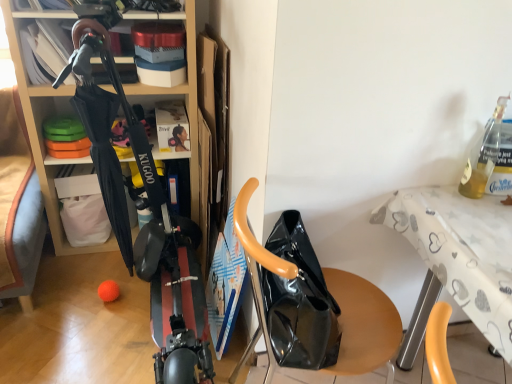
Question: Is glossy black bag at center next to black glossy scooter at center?

Choices:
 (A) yes
 (B) no

Answer: (B)

Question: Could you tell me if glossy black bag at center is facing black glossy scooter at center?

Choices:
 (A) yes
 (B) no

Answer: (B)

Question: From a real-world perspective, is glossy black bag at center below black glossy scooter at center?

Choices:
 (A) yes
 (B) no

Answer: (A)

Question: From the image's perspective, does glossy black bag at center appear higher than black glossy scooter at center?

Choices:
 (A) yes
 (B) no

Answer: (B)

Question: Does glossy black bag at center have a smaller size compared to black glossy scooter at center?

Choices:
 (A) no
 (B) yes

Answer: (B)

Question: Looking at their shapes, would you say glossy black bag at center is wider or thinner than black glossy scooter at center?

Choices:
 (A) thin
 (B) wide

Answer: (B)

Question: In terms of height, does glossy black bag at center look taller or shorter compared to black glossy scooter at center?

Choices:
 (A) short
 (B) tall

Answer: (A)

Question: Looking at the image, does glossy black bag at center seem bigger or smaller compared to black glossy scooter at center?

Choices:
 (A) small
 (B) big

Answer: (A)

Question: From the image's perspective, is glossy black bag at center positioned above or below black glossy scooter at center?

Choices:
 (A) below
 (B) above

Answer: (A)

Question: From their relative heights in the image, would you say white printed fabric table at upper right is taller or shorter than glossy black bag at center?

Choices:
 (A) short
 (B) tall

Answer: (A)

Question: Relative to glossy black bag at center, is white printed fabric table at upper right in front or behind?

Choices:
 (A) front
 (B) behind

Answer: (B)

Question: In terms of width, does white printed fabric table at upper right look wider or thinner when compared to glossy black bag at center?

Choices:
 (A) wide
 (B) thin

Answer: (A)

Question: From the image's perspective, is white printed fabric table at upper right above or below glossy black bag at center?

Choices:
 (A) below
 (B) above

Answer: (A)

Question: Considering the positions of point (493, 140) and point (264, 337), is point (493, 140) closer or farther from the camera than point (264, 337)?

Choices:
 (A) farther
 (B) closer

Answer: (B)

Question: Is translucent glass bottle at upper right wider or thinner than glossy black bag at center?

Choices:
 (A) wide
 (B) thin

Answer: (B)